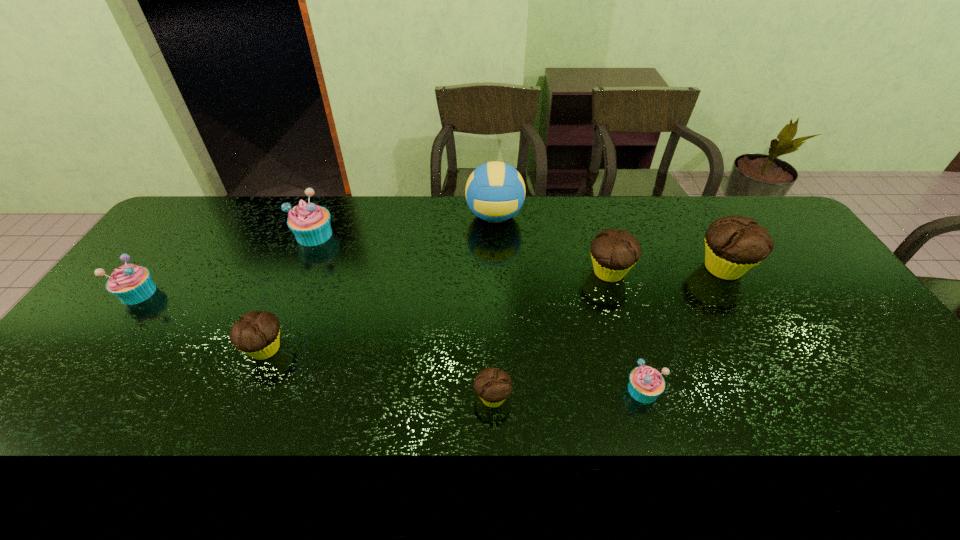
The image size is (960, 540). In order to click on vacant space located 0.080m on the front of the leftmost chocolate muffin in this screenshot , I will do `click(245, 397)`.

Image resolution: width=960 pixels, height=540 pixels. In order to click on free region located 0.270m on the right of the smallest blue muffin in this screenshot , I will do `click(770, 390)`.

Where is `vacant space located 0.100m on the left of the third chocolate muffin from right to left`? This screenshot has height=540, width=960. vacant space located 0.100m on the left of the third chocolate muffin from right to left is located at coordinates (432, 398).

The image size is (960, 540). Identify the location of volleyball present at the far edge. (495, 191).

This screenshot has height=540, width=960. I want to click on muffin positioned at the far edge, so click(x=310, y=223).

Where is `object that is at the left edge`? The width and height of the screenshot is (960, 540). object that is at the left edge is located at coordinates [x=131, y=284].

Image resolution: width=960 pixels, height=540 pixels. Find the location of `vacant space at the far edge of the desktop`. vacant space at the far edge of the desktop is located at coordinates (428, 237).

The width and height of the screenshot is (960, 540). In the image, there is a desktop. Find the location of `vacant space at the right edge`. vacant space at the right edge is located at coordinates (904, 398).

At what (x,y) coordinates should I click in order to perform the action: click on vacant region at the far left corner. Please return your answer as a coordinate pair (x, y). The image size is (960, 540). Looking at the image, I should click on (197, 199).

The image size is (960, 540). I want to click on free space that is in between the second chocolate muffin from right to left and the rightmost muffin, so click(x=666, y=271).